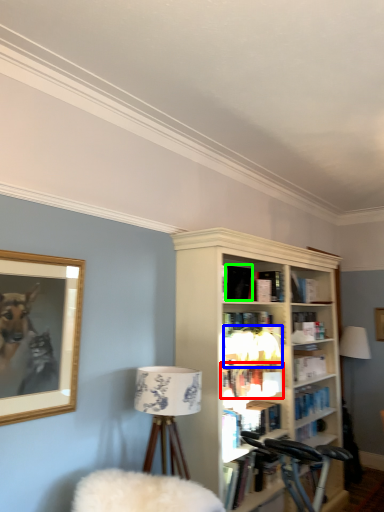
Question: Considering the real-world distances, which object is farthest from book (highlighted by a red box)? lamp (highlighted by a blue box) or book (highlighted by a green box)?

Choices:
 (A) lamp
 (B) book

Answer: (B)